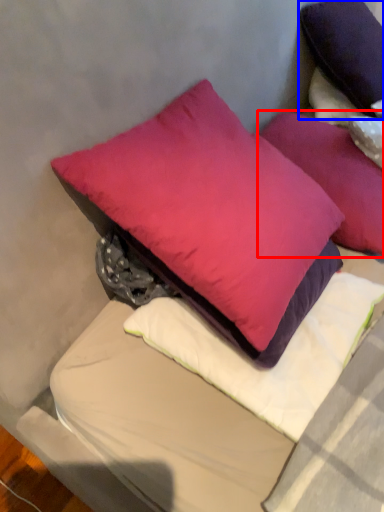
Question: Which object appears closest to the camera in this image, pillow (highlighted by a red box) or pillow (highlighted by a blue box)?

Choices:
 (A) pillow
 (B) pillow

Answer: (A)